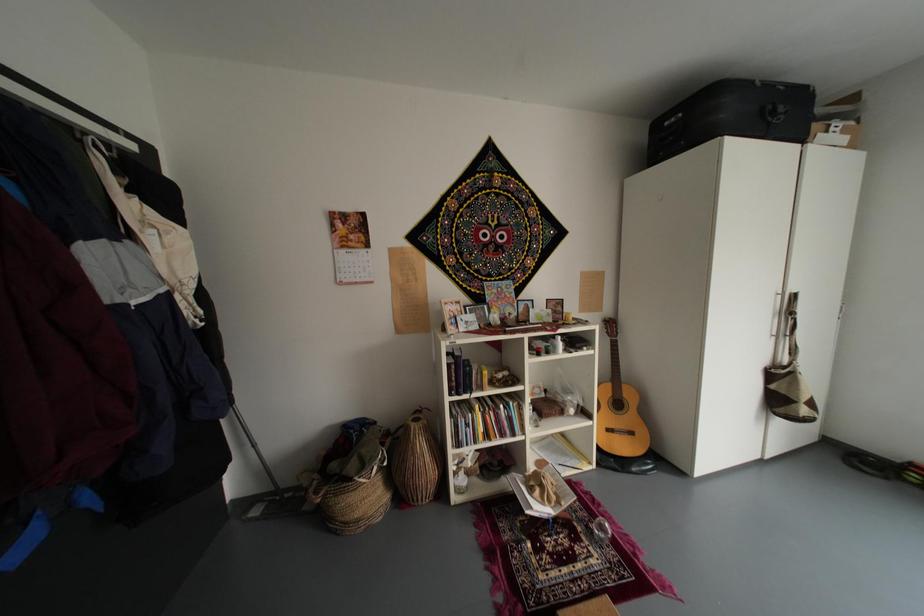
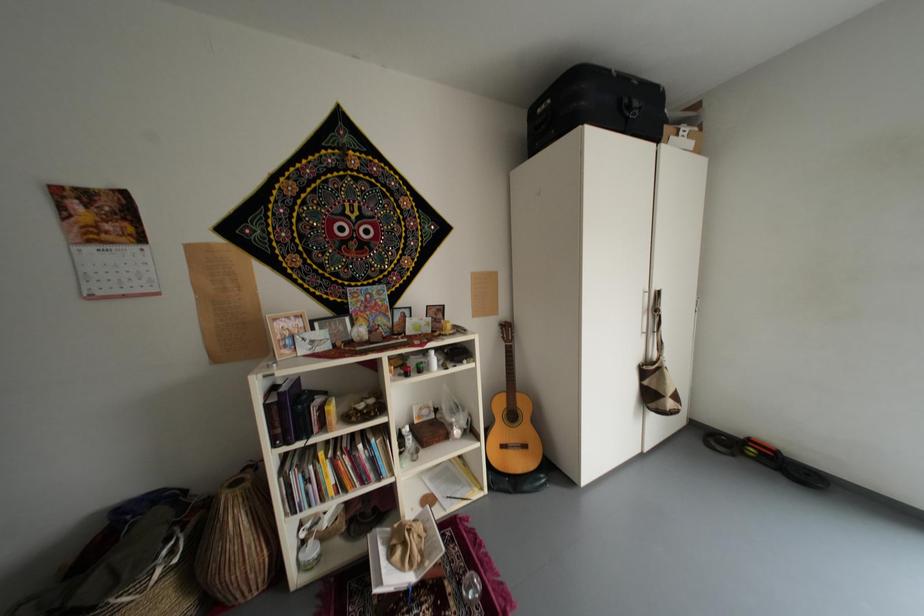
Question: The first image is from the beginning of the video and the second image is from the end. How did the camera likely rotate when shooting the video?

Choices:
 (A) Left
 (B) Right
 (C) Up
 (D) Down

Answer: (B)